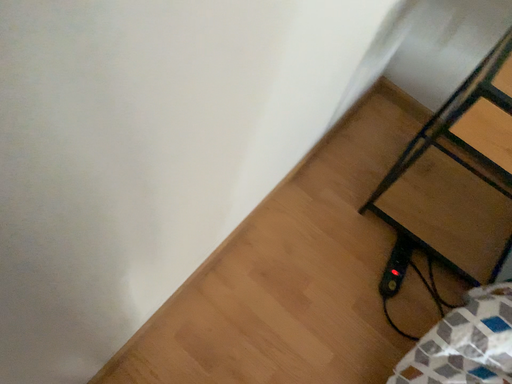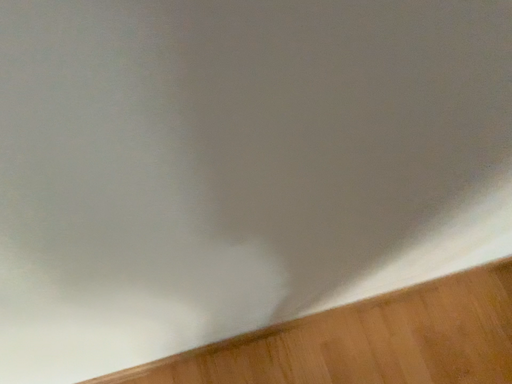
Question: How did the camera likely rotate when shooting the video?

Choices:
 (A) rotated left
 (B) rotated right

Answer: (A)